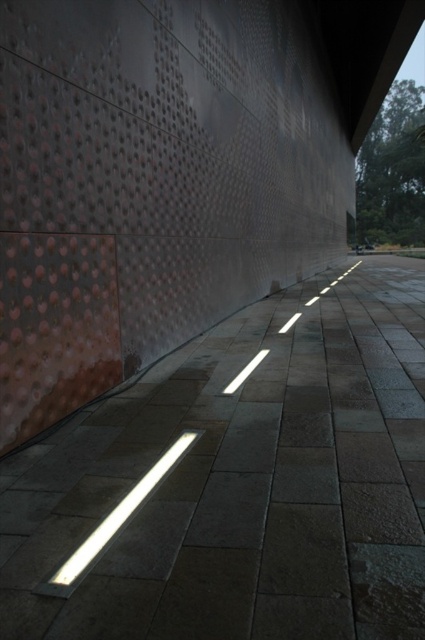
Locate an element on the screen. The image size is (425, 640). slate gray paving stone at center is located at coordinates (243, 481).

Describe the element at coordinates (243, 481) in the screenshot. I see `slate gray paving stone at center` at that location.

Is point (195, 484) behind point (132, 496)?

That is True.

The height and width of the screenshot is (640, 425). I want to click on slate gray paving stone at center, so click(x=243, y=481).